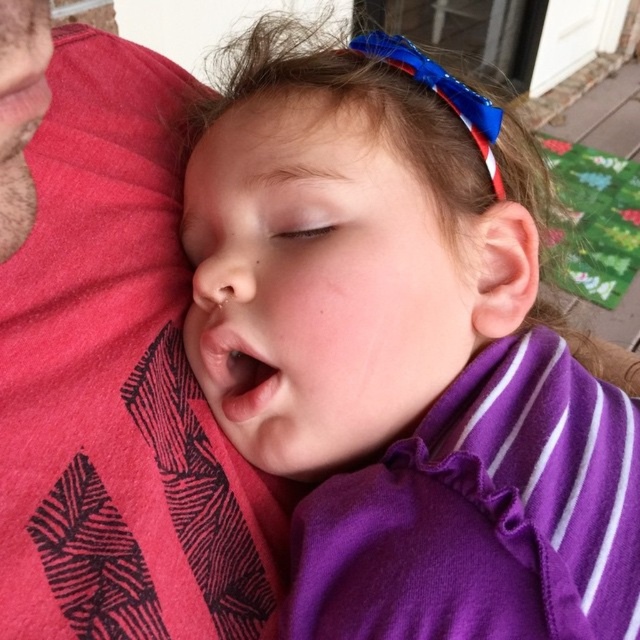
You are a photographer trying to capture a candid shot of the child resting on the shoulder. You are currently positioned at the point marked as point (248,529). To ensure the child remains unaware, you need to maintain a distance of at least 17 inches from them. Is your current position sufficient to keep the child unaware?

The distance between point (248,529) and the camera is 16.60 inches, which is less than the required 17 inches. Therefore, your current position might not be sufficient to keep the child unaware as you are slightly closer than the desired distance.

You are a photographer trying to capture a candid shot of the child and the person holding them. You notice the pink fabric at left and the smooth skin at upper center in your viewfinder. Which object should you focus on to ensure the child remains the main subject of the photo?

The pink fabric at left is positioned on the left side of smooth skin at upper center. To keep the child as the main subject, focus on the smooth skin at upper center since it is closer to the child.